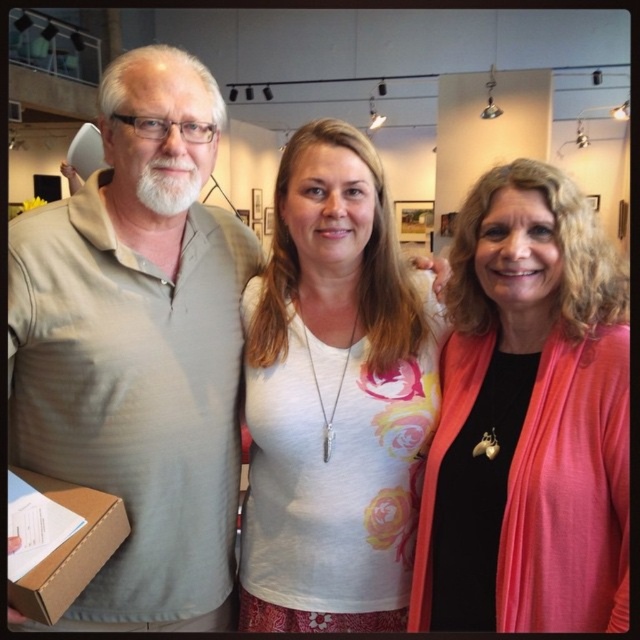
Who is positioned more to the left, white floral shirt at center or brown cardboard box at lower left?

From the viewer's perspective, brown cardboard box at lower left appears more on the left side.

Who is more forward, (288,374) or (12,614)?

Point (12,614)

Where is `white floral shirt at center`? Image resolution: width=640 pixels, height=640 pixels. white floral shirt at center is located at coordinates (333, 397).

Who is lower down, light beige cotton shirt at left or pink matte cardigan at center?

Positioned lower is pink matte cardigan at center.

Is point (42, 209) more distant than point (596, 394)?

That is True.

Does point (44, 369) lie in front of point (595, 630)?

No.

Where is `light beige cotton shirt at left`? light beige cotton shirt at left is located at coordinates [x=138, y=348].

Can you confirm if pink matte cardigan at center is wider than white floral shirt at center?

In fact, pink matte cardigan at center might be narrower than white floral shirt at center.

Is pink matte cardigan at center bigger than white floral shirt at center?

Actually, pink matte cardigan at center might be smaller than white floral shirt at center.

Which is behind, point (552, 368) or point (300, 444)?

The point (300, 444) is more distant.

This screenshot has height=640, width=640. In order to click on pink matte cardigan at center in this screenshot , I will do `click(529, 419)`.